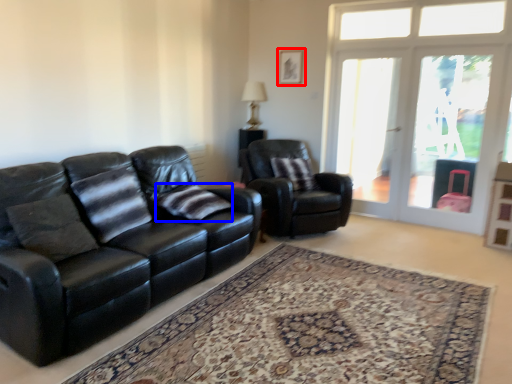
Question: Which point is further to the camera, picture frame (highlighted by a red box) or pillow (highlighted by a blue box)?

Choices:
 (A) picture frame
 (B) pillow

Answer: (A)